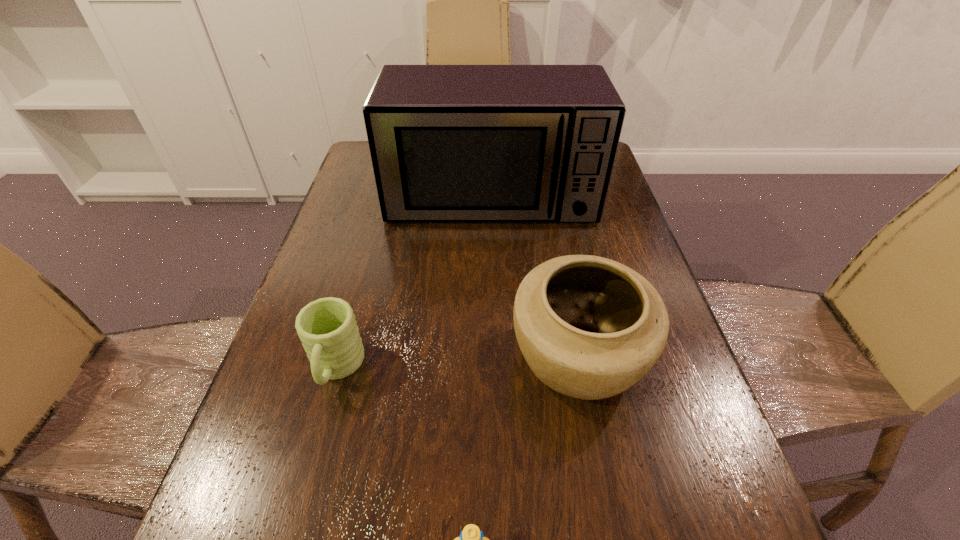
Locate an element on the screen. This screenshot has height=540, width=960. microwave_oven is located at coordinates (449, 143).

Identify the location of the farthest object. Image resolution: width=960 pixels, height=540 pixels. (449, 143).

Find the location of a particular element. pottery is located at coordinates (589, 327).

I want to click on mug, so click(327, 327).

This screenshot has width=960, height=540. I want to click on vacant space located on the front-facing side of the tallest object, so click(x=493, y=289).

This screenshot has width=960, height=540. In order to click on free spot located on the back of the pottery in this screenshot , I will do `click(559, 262)`.

Where is `free space located 0.190m on the side of the mug with the handle`? This screenshot has height=540, width=960. free space located 0.190m on the side of the mug with the handle is located at coordinates (295, 519).

Where is `object that is at the far edge`? This screenshot has width=960, height=540. object that is at the far edge is located at coordinates (449, 143).

Find the location of a particular element. microwave_oven positioned at the left edge is located at coordinates (449, 143).

This screenshot has height=540, width=960. Identify the location of mug that is at the left edge. (327, 327).